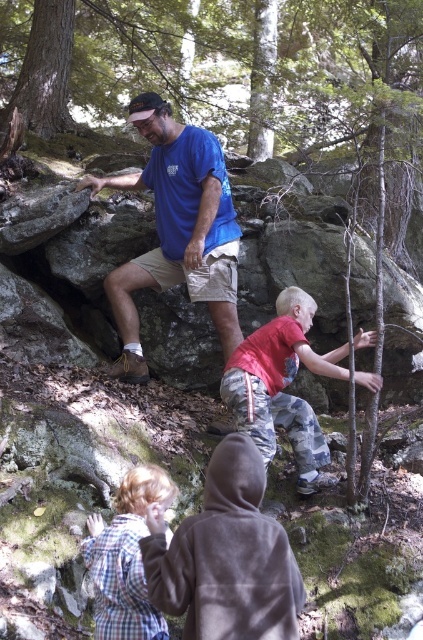
You are a photographer trying to capture a photo of the camouflage pants at center and the plaid fabric shirt at lower left. To ensure both subjects are in frame, should you adjust your camera to focus more to the left or the right side of the current view?

The camouflage pants at center is positioned on the right side of plaid fabric shirt at lower left, so you should adjust your camera to focus more to the left to include both subjects in the frame.